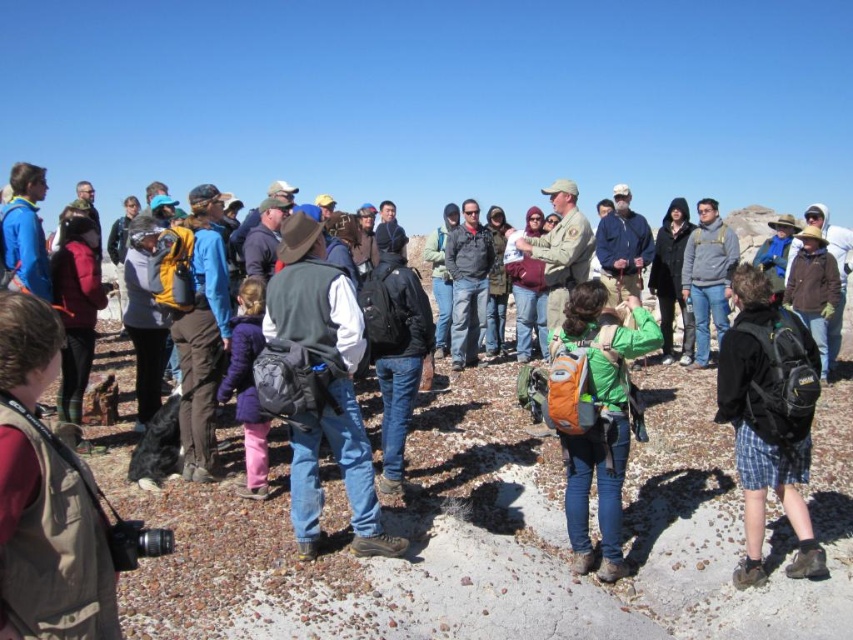
Question: Does black matte backpack at lower right have a greater width compared to green fabric backpack at center?

Choices:
 (A) yes
 (B) no

Answer: (B)

Question: Which object appears closest to the camera in this image?

Choices:
 (A) black matte backpack at lower right
 (B) denim jacket at center

Answer: (A)

Question: Can you confirm if matte black backpack at center is positioned to the left of green fabric backpack at center?

Choices:
 (A) no
 (B) yes

Answer: (B)

Question: Which point is closer to the camera?

Choices:
 (A) black matte backpack at lower right
 (B) brown suede vest at lower left
 (C) denim jacket at center

Answer: (B)

Question: Does matte black backpack at center lie in front of brown suede vest at lower left?

Choices:
 (A) yes
 (B) no

Answer: (B)

Question: Which is nearer to the black matte backpack at lower right?

Choices:
 (A) matte black backpack at center
 (B) brown suede vest at lower left

Answer: (A)